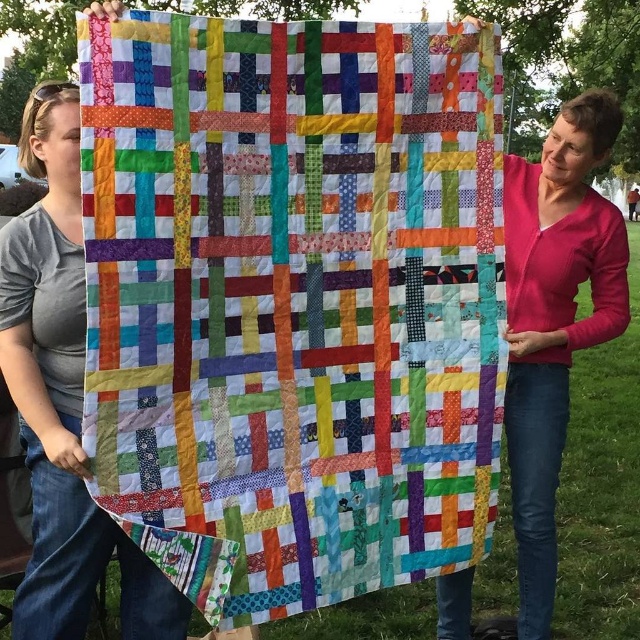
Who is positioned more to the right, quilted fabric quilt at center or matte cotton quilt at left?

Positioned to the right is quilted fabric quilt at center.

Is point (115, 253) behind point (124, 586)?

No, it is not.

Does point (106, 337) lie behind point (74, 556)?

No, it is in front of (74, 556).

The image size is (640, 640). I want to click on quilted fabric quilt at center, so click(294, 298).